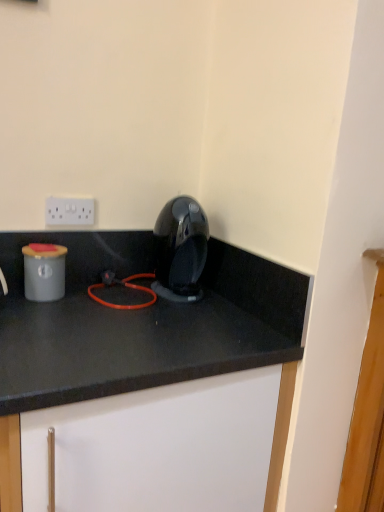
Question: Does glossy plastic coffee machine at center appear on the left side of white matte cabinet at center?

Choices:
 (A) yes
 (B) no

Answer: (B)

Question: Does glossy plastic coffee machine at center have a lesser height compared to white matte cabinet at center?

Choices:
 (A) yes
 (B) no

Answer: (A)

Question: Is the depth of glossy plastic coffee machine at center less than that of white matte cabinet at center?

Choices:
 (A) no
 (B) yes

Answer: (A)

Question: From a real-world perspective, is glossy plastic coffee machine at center positioned under white matte cabinet at center based on gravity?

Choices:
 (A) no
 (B) yes

Answer: (A)

Question: Is glossy plastic coffee machine at center smaller than white matte cabinet at center?

Choices:
 (A) yes
 (B) no

Answer: (A)

Question: Is glossy plastic coffee machine at center directly adjacent to white matte cabinet at center?

Choices:
 (A) yes
 (B) no

Answer: (B)

Question: From the image's perspective, is white matte cabinet at center located beneath glossy plastic coffee machine at center?

Choices:
 (A) yes
 (B) no

Answer: (A)

Question: Is white matte cabinet at center to the left of glossy plastic coffee machine at center from the viewer's perspective?

Choices:
 (A) yes
 (B) no

Answer: (A)

Question: Would you say white matte cabinet at center contains glossy plastic coffee machine at center?

Choices:
 (A) no
 (B) yes

Answer: (A)

Question: Considering the relative positions of white matte cabinet at center and glossy plastic coffee machine at center in the image provided, is white matte cabinet at center to the right of glossy plastic coffee machine at center from the viewer's perspective?

Choices:
 (A) yes
 (B) no

Answer: (B)

Question: From a real-world perspective, is white matte cabinet at center physically above glossy plastic coffee machine at center?

Choices:
 (A) yes
 (B) no

Answer: (B)

Question: Is white matte cabinet at center shorter than glossy plastic coffee machine at center?

Choices:
 (A) no
 (B) yes

Answer: (A)

Question: Does white plastic electric outlet at upper center lie behind glossy plastic coffee machine at center?

Choices:
 (A) no
 (B) yes

Answer: (B)